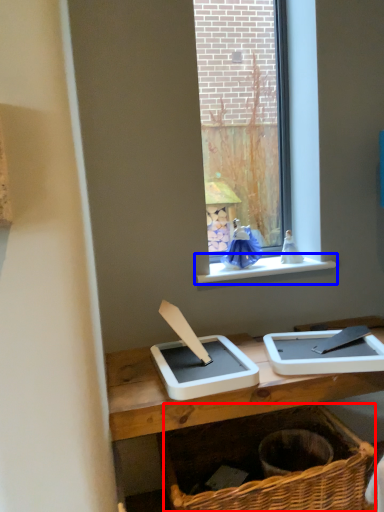
Question: Among these objects, which one is farthest to the camera, basket (highlighted by a red box) or window sill (highlighted by a blue box)?

Choices:
 (A) basket
 (B) window sill

Answer: (B)